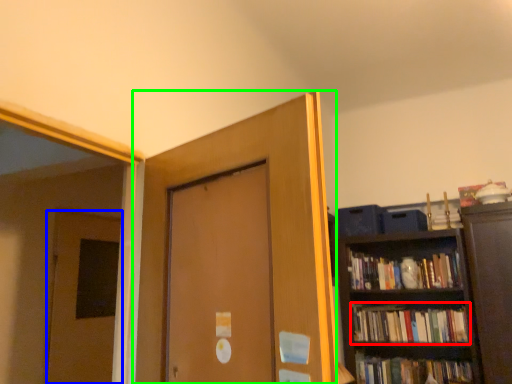
Question: Which is farther away from book (highlighted by a red box)? door (highlighted by a blue box) or door (highlighted by a green box)?

Choices:
 (A) door
 (B) door

Answer: (B)